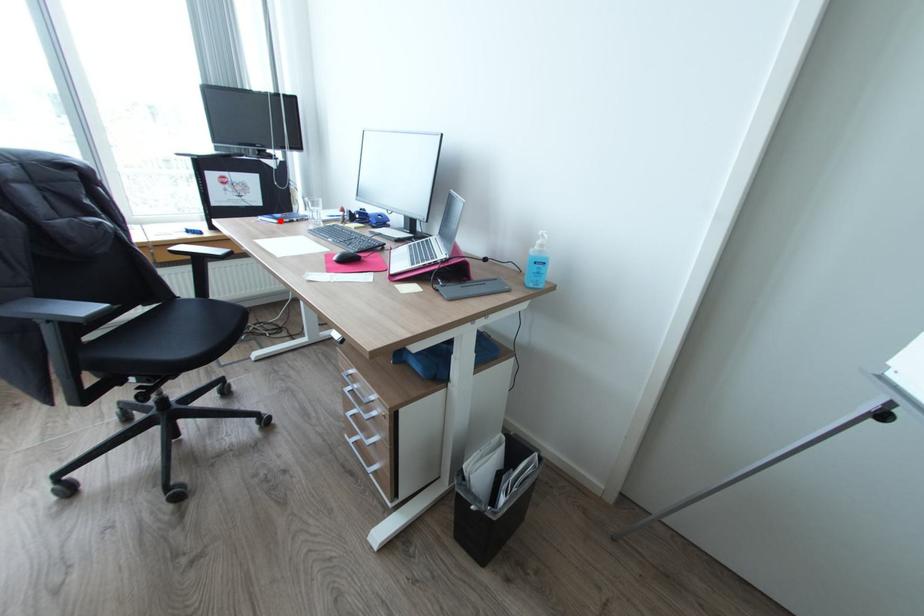
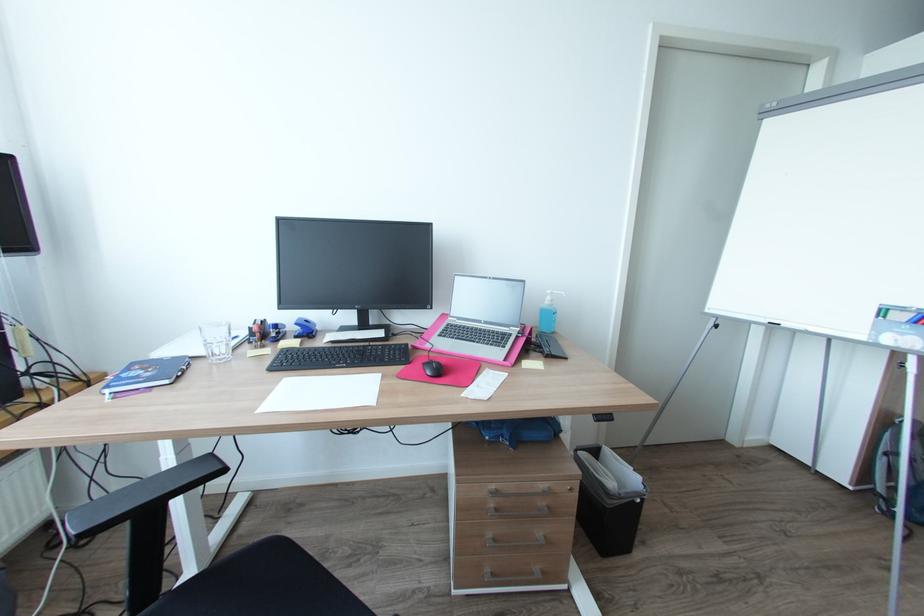
Question: I am providing you with two images of the same scene from different viewpoints. A red point is marked on the first image. Can you still see the location of the red point in image 2?

Choices:
 (A) Yes
 (B) No

Answer: (A)